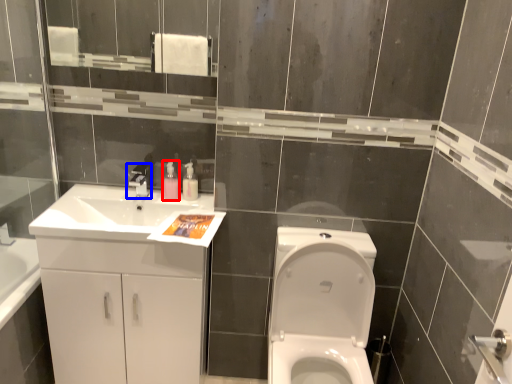
Question: Among these objects, which one is nearest to the camera, soap dispenser (highlighted by a red box) or tap (highlighted by a blue box)?

Choices:
 (A) soap dispenser
 (B) tap

Answer: (B)